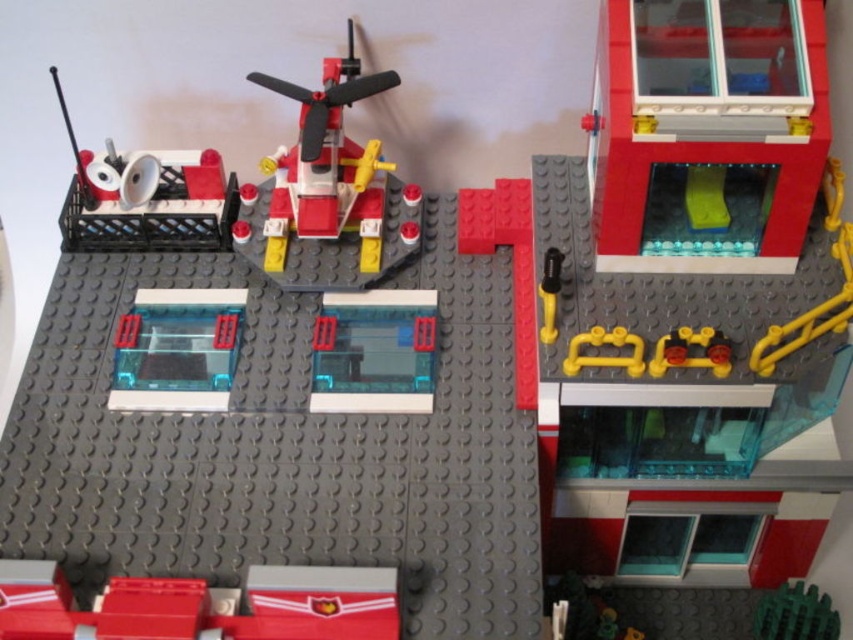
You are a Lego architect designing a new fire station. You want to place a new red Lego brick at the location marked by point [706,122]. What existing Lego element is already at that position?

The transparent plastic window at upper right is already located at point [706,122].

You are standing in front of the Lego fire station model. There is a transparent plastic window at lower left. Can you see through it to the interior of the building?

Yes, the transparent plastic window at lower left allows you to see through it to the interior of the building.

You are a child who wants to play with both the transparent plastic window at lower left and the green rubber ball at lower right. Which object is larger so you can decide which to pick up first?

The transparent plastic window at lower left is bigger than the green rubber ball at lower right, so you should pick up the transparent plastic window at lower left first.